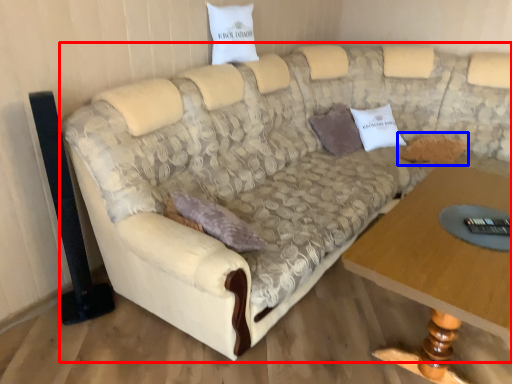
Question: Among these objects, which one is farthest to the camera, studio couch (highlighted by a red box) or pillow (highlighted by a blue box)?

Choices:
 (A) studio couch
 (B) pillow

Answer: (B)